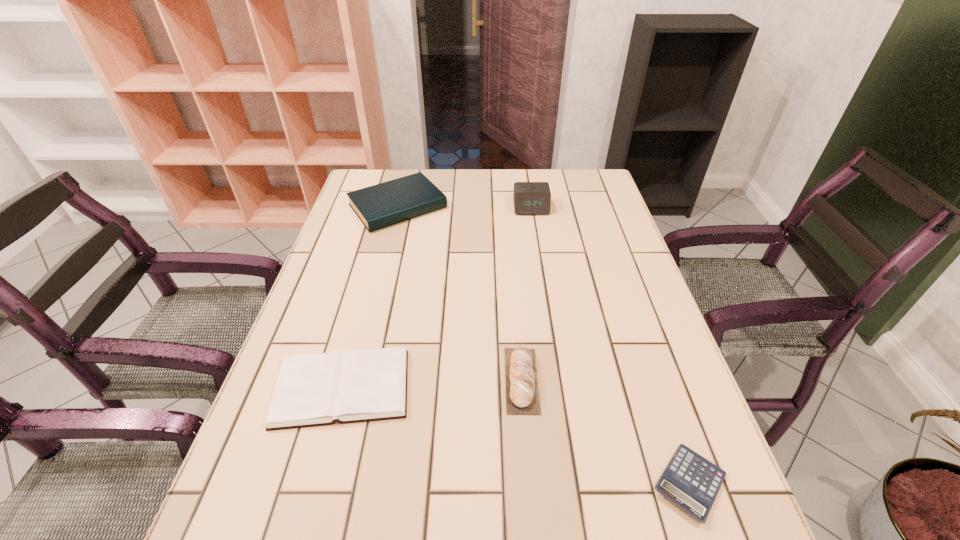
Image resolution: width=960 pixels, height=540 pixels. In order to click on object that is the fourth closest to the pita bread in this screenshot , I will do `click(530, 198)`.

Image resolution: width=960 pixels, height=540 pixels. Identify the location of free space that satisfies the following two spatial constraints: 1. on the front side of the taller hardback book; 2. on the left side of the nearest object. (328, 484).

Locate an element on the screen. This screenshot has height=540, width=960. free point that satisfies the following two spatial constraints: 1. on the front-facing side of the alarm clock; 2. on the right side of the shortest object is located at coordinates (574, 484).

Find the location of a particular element. vacant point that satisfies the following two spatial constraints: 1. on the front side of the pita bread; 2. on the left side of the shortest object is located at coordinates (530, 484).